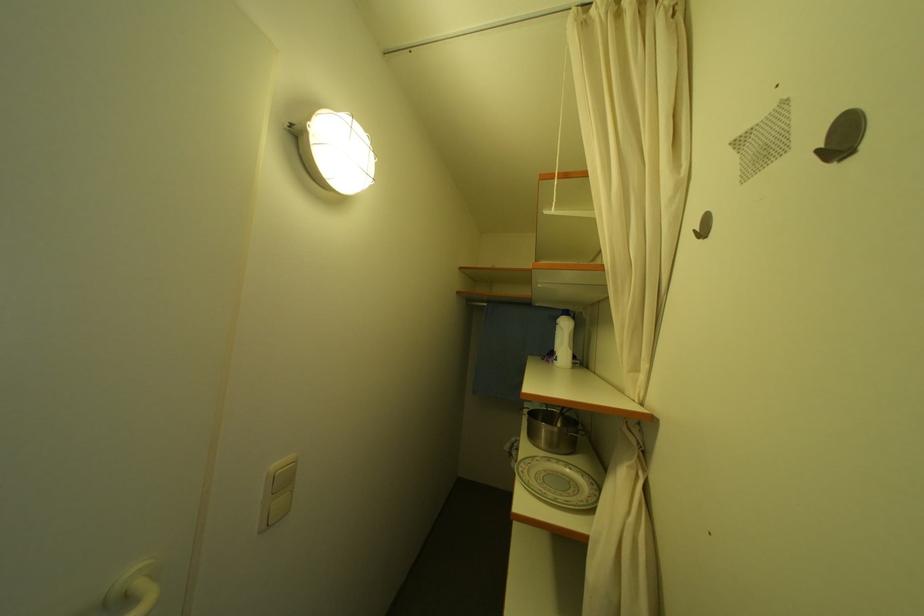
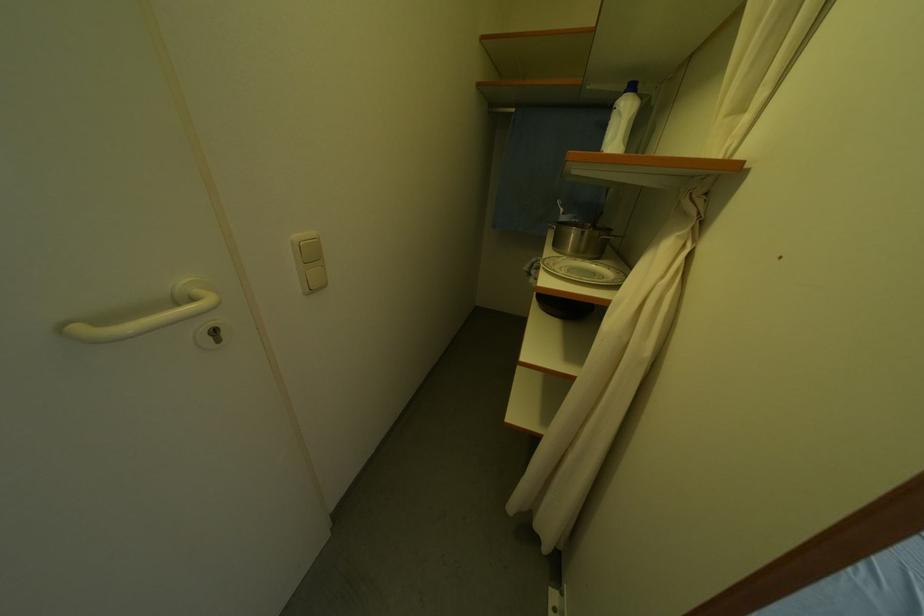
Where in the second image is the point corresponding to the point at 529,472 from the first image?

(554, 265)